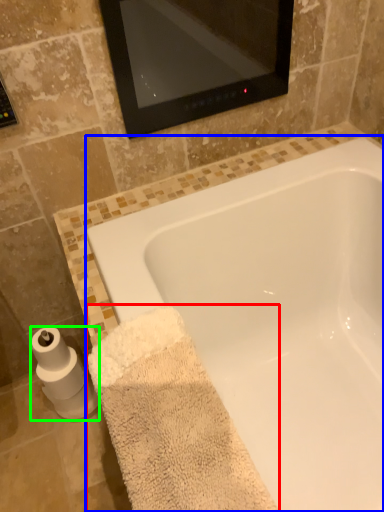
Question: Based on their relative distances, which object is nearer to bath towel (highlighted by a red box)? Choose from bathtub (highlighted by a blue box) and toilet paper (highlighted by a green box).

Choices:
 (A) bathtub
 (B) toilet paper

Answer: (A)